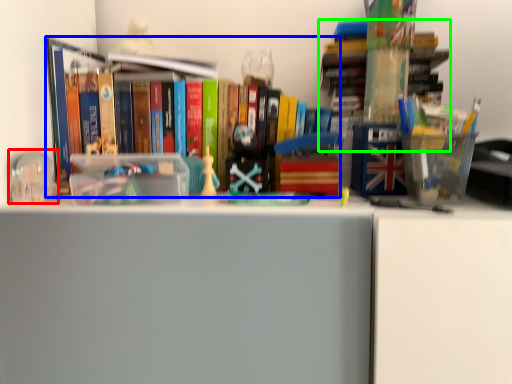
Question: Considering the real-world distances, which object is farthest from toy (highlighted by a red box)? book (highlighted by a blue box) or book (highlighted by a green box)?

Choices:
 (A) book
 (B) book

Answer: (B)